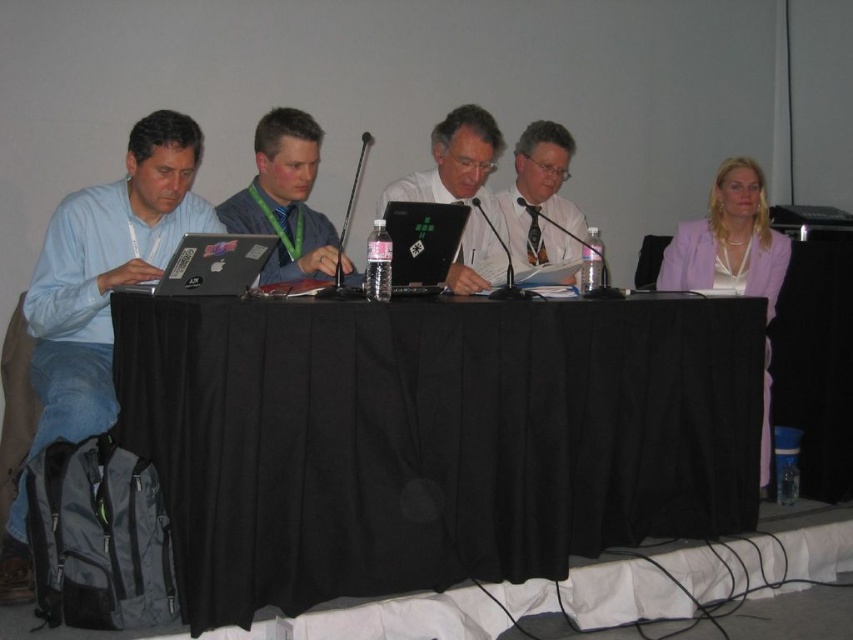
Question: Does matte blue shirt at left lie behind matte blue shirt at center?

Choices:
 (A) yes
 (B) no

Answer: (B)

Question: Does matte black laptop at center have a larger size compared to black plastic laptop at center?

Choices:
 (A) no
 (B) yes

Answer: (B)

Question: Which point is closer to the camera taking this photo?

Choices:
 (A) (207, 243)
 (B) (473, 250)
 (C) (553, 211)

Answer: (A)

Question: Which point is farther to the camera?

Choices:
 (A) matte black laptop at left
 (B) black fabric table at center
 (C) black plastic laptop at center
 (D) matte white shirt at center

Answer: (D)

Question: Can you confirm if lavender fabric jacket at right is positioned to the right of matte black laptop at left?

Choices:
 (A) no
 (B) yes

Answer: (B)

Question: Which point appears closest to the camera in this image?

Choices:
 (A) (247, 248)
 (B) (766, 401)

Answer: (A)